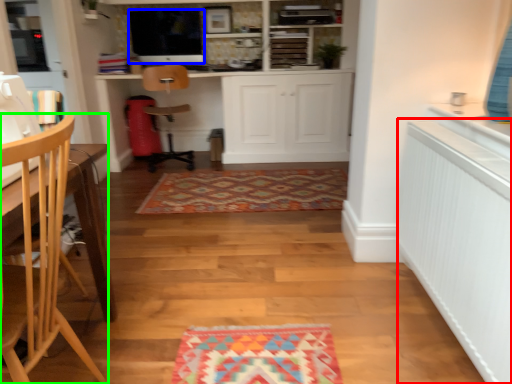
Question: Which object is the closest to the radiator (highlighted by a red box)? Choose among these: appliance (highlighted by a blue box) or chair (highlighted by a green box).

Choices:
 (A) appliance
 (B) chair

Answer: (B)